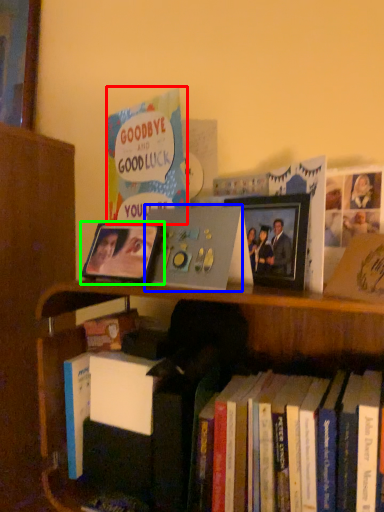
Question: Based on their relative distances, which object is nearer to book (highlighted by a red box)? Choose from paperback book (highlighted by a blue box) and picture frame (highlighted by a green box).

Choices:
 (A) paperback book
 (B) picture frame

Answer: (B)